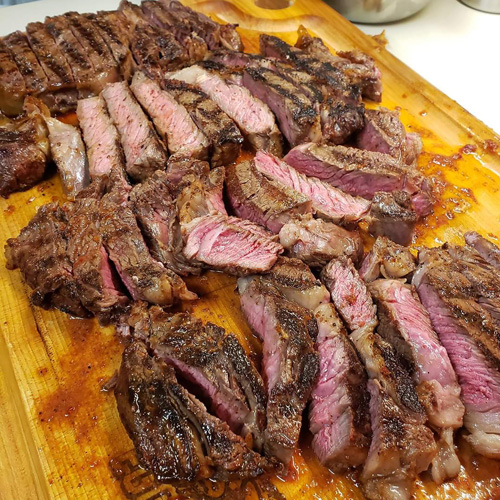
The height and width of the screenshot is (500, 500). What are the coordinates of `wooden board` in the screenshot? It's located at (22, 397).